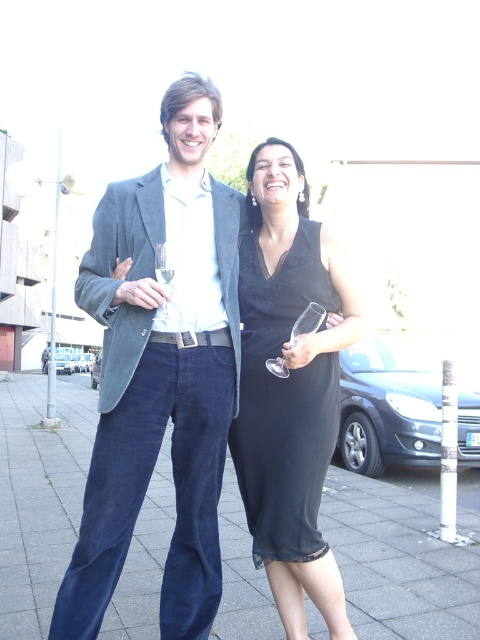
Can you confirm if dark blue concrete pavement at lower center is bigger than black satin dress at center?

Indeed, dark blue concrete pavement at lower center has a larger size compared to black satin dress at center.

The image size is (480, 640). Find the location of `dark blue concrete pavement at lower center`. dark blue concrete pavement at lower center is located at coordinates (399, 561).

Find the location of a particular element. This screenshot has width=480, height=640. dark blue concrete pavement at lower center is located at coordinates (399, 561).

Is matte gray blazer at center further to camera compared to black satin dress at center?

No.

Image resolution: width=480 pixels, height=640 pixels. What are the coordinates of `matte gray blazer at center` in the screenshot? It's located at (159, 372).

Locate an element on the screen. This screenshot has height=640, width=480. matte gray blazer at center is located at coordinates (159, 372).

This screenshot has width=480, height=640. What are the coordinates of `matte gray blazer at center` in the screenshot? It's located at (159, 372).

In the scene shown: Is matte gray blazer at center above clear glass wine glass at center?

Incorrect, matte gray blazer at center is not positioned above clear glass wine glass at center.

Is point (180, 532) more distant than point (170, 266)?

Yes, it is behind point (170, 266).

The image size is (480, 640). What are the coordinates of `matte gray blazer at center` in the screenshot? It's located at (159, 372).